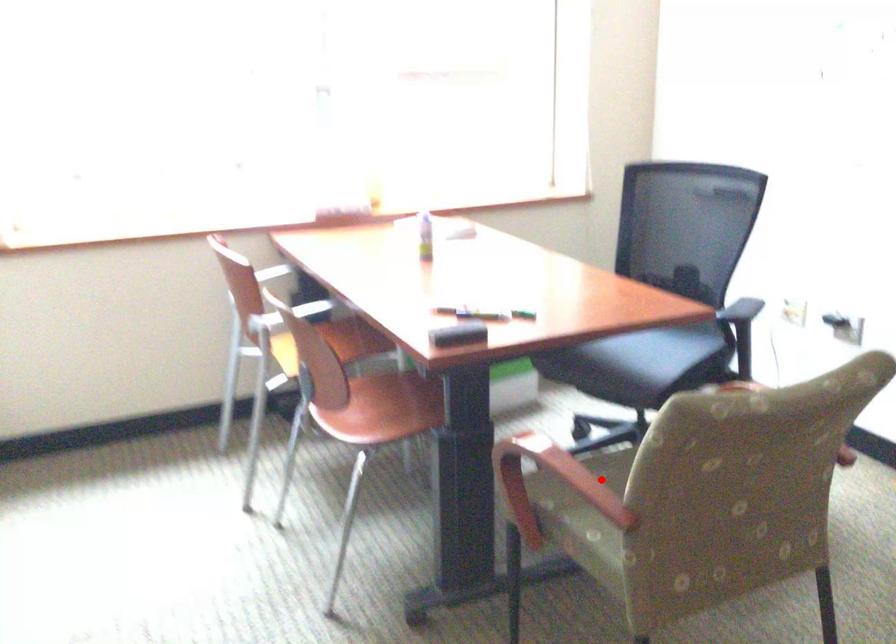
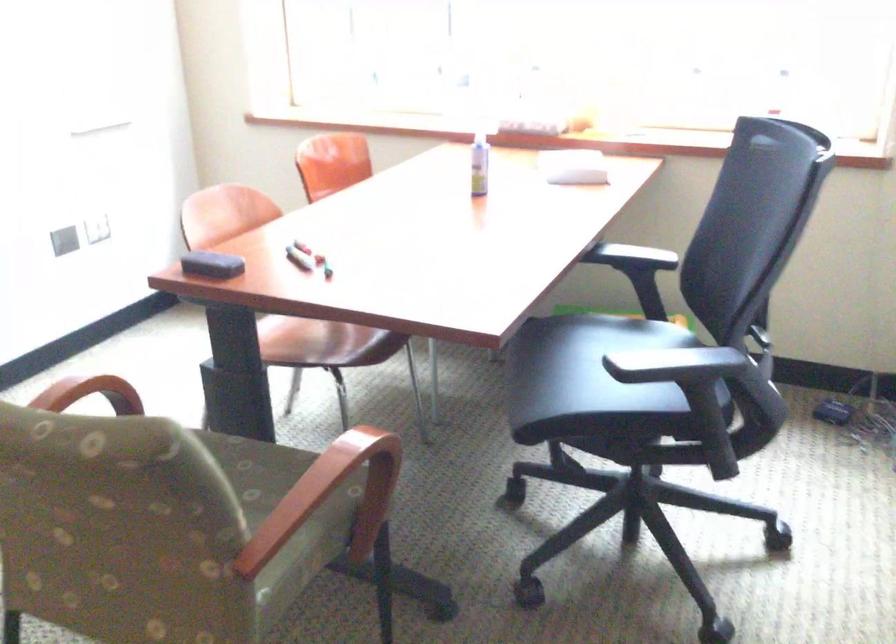
In the second image, find the point that corresponds to the highlighted location in the first image.

(251, 469)